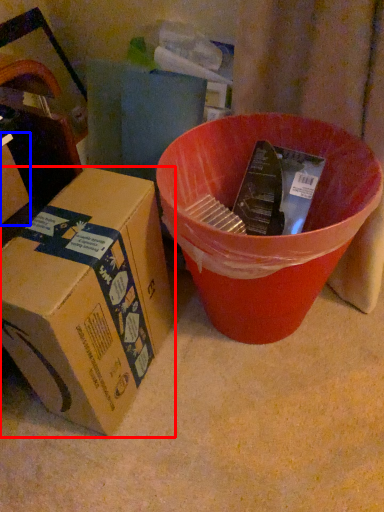
Question: Which of the following is the farthest to the observer, box (highlighted by a red box) or box (highlighted by a blue box)?

Choices:
 (A) box
 (B) box

Answer: (A)